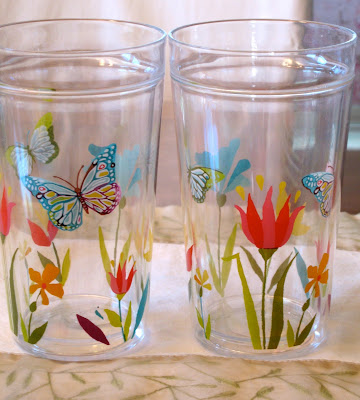
At what (x,y) coordinates should I click in order to perform the action: click on rim of cup. Please return your answer as a coordinate pair (x, y). This screenshot has height=400, width=360. Looking at the image, I should click on (266, 20).